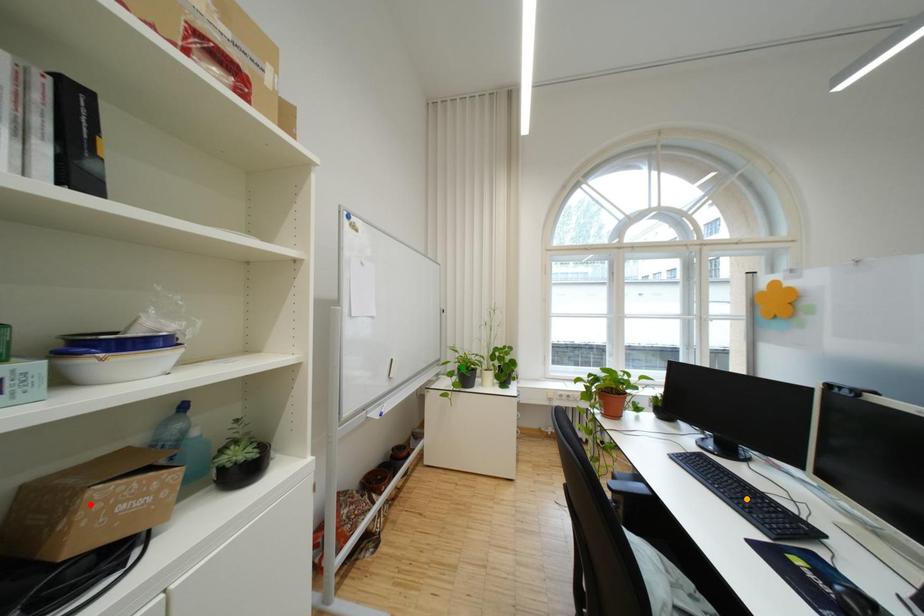
Order these from nearest to farthest:
A) red point
B) orange point
C) green point

red point → orange point → green point